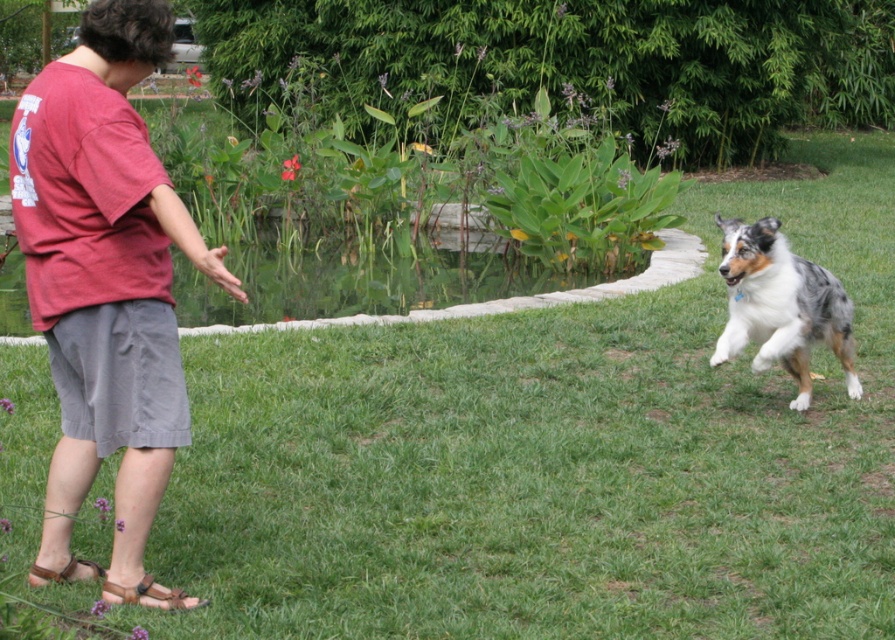
Who is shorter, red cotton t-shirt at left or blue-gray fur dog at right?

blue-gray fur dog at right is shorter.

Who is more distant from viewer, (175, 381) or (732, 257)?

The point (732, 257) is behind.

Locate an element on the screen. Image resolution: width=895 pixels, height=640 pixels. red cotton t-shirt at left is located at coordinates (105, 285).